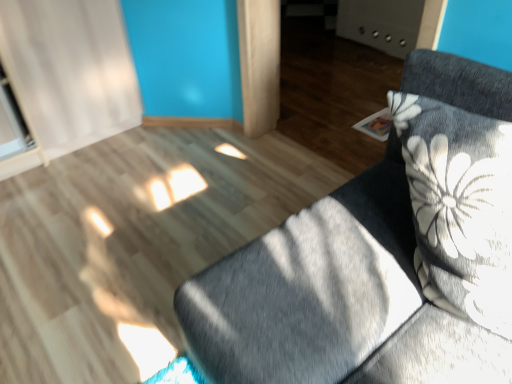
Locate an element on the screen. Image resolution: width=512 pixels, height=384 pixels. velvet gray sofa cushion at right is located at coordinates (382, 257).

Image resolution: width=512 pixels, height=384 pixels. What do you see at coordinates (382, 257) in the screenshot?
I see `velvet gray sofa cushion at right` at bounding box center [382, 257].

This screenshot has width=512, height=384. Find the location of `velvet gray sofa cushion at right`. velvet gray sofa cushion at right is located at coordinates (382, 257).